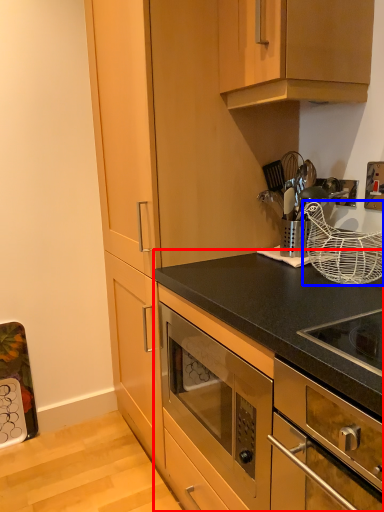
Question: Which point is closer to the camera, cabinetry (highlighted by a red box) or basket (highlighted by a blue box)?

Choices:
 (A) cabinetry
 (B) basket

Answer: (A)